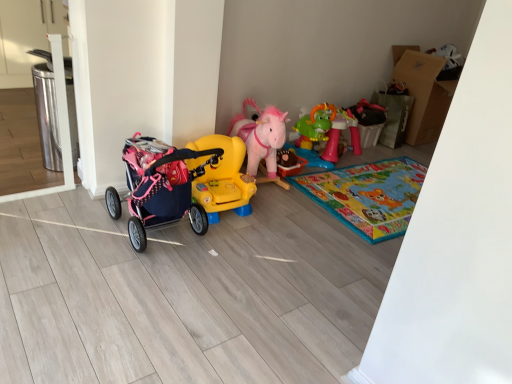
What do you see at coordinates (261, 139) in the screenshot? I see `pink plush horse at center, marked as the 2th toy in a right-to-left arrangement` at bounding box center [261, 139].

Image resolution: width=512 pixels, height=384 pixels. What do you see at coordinates (223, 178) in the screenshot? I see `yellow plastic ride-on car at center, the 2th toy positioned from the left` at bounding box center [223, 178].

What do you see at coordinates (162, 186) in the screenshot? This screenshot has width=512, height=384. I see `pink fabric stroller at left, which is counted as the 4th toy, starting from the right` at bounding box center [162, 186].

Where is `pink fabric stroller at left, the 1th toy when ordered from left to right`? The height and width of the screenshot is (384, 512). pink fabric stroller at left, the 1th toy when ordered from left to right is located at coordinates (162, 186).

I want to click on rubberized green dinosaur table at center-right, which ranks as the 4th toy in left-to-right order, so click(x=324, y=134).

This screenshot has width=512, height=384. What are the coordinates of `pink plush horse at center, marked as the 2th toy in a right-to-left arrangement` in the screenshot? It's located at (261, 139).

Is pink plush horse at center, placed as the third toy when sorted from left to right, inside the boundaries of yellow plastic ride-on car at center, which is the third toy in right-to-left order, or outside?

pink plush horse at center, placed as the third toy when sorted from left to right, exists outside the volume of yellow plastic ride-on car at center, which is the third toy in right-to-left order.

Can you confirm if pink plush horse at center, placed as the third toy when sorted from left to right, is thinner than yellow plastic ride-on car at center, the 2th toy positioned from the left?

Incorrect, the width of pink plush horse at center, placed as the third toy when sorted from left to right, is not less than that of yellow plastic ride-on car at center, the 2th toy positioned from the left.

How different are the orientations of pink plush horse at center, marked as the 2th toy in a right-to-left arrangement, and yellow plastic ride-on car at center, the 2th toy positioned from the left, in degrees?

11.8 degrees separate the facing orientations of pink plush horse at center, marked as the 2th toy in a right-to-left arrangement, and yellow plastic ride-on car at center, the 2th toy positioned from the left.

You are a GUI agent. You are given a task and a screenshot of the screen. Output one action in this format:
    pyautogui.click(x=<x>, y=<y>)
    Task: Click on the toy that is the 2nd object above the yellow plastic ride-on car at center, which is the third toy in right-to-left order (from a real-world perspective)
    The width and height of the screenshot is (512, 384).
    Given the screenshot: What is the action you would take?
    pyautogui.click(x=261, y=139)

Which of these two, pink fabric stroller at left, which is counted as the 4th toy, starting from the right, or yellow plastic ride-on car at center, the 2th toy positioned from the left, is thinner?

yellow plastic ride-on car at center, the 2th toy positioned from the left.

Is pink fabric stroller at left, which is counted as the 4th toy, starting from the right, smaller than yellow plastic ride-on car at center, the 2th toy positioned from the left?

No, pink fabric stroller at left, which is counted as the 4th toy, starting from the right, is not smaller than yellow plastic ride-on car at center, the 2th toy positioned from the left.

From a real-world perspective, which object stands above the other?

pink fabric stroller at left, which is counted as the 4th toy, starting from the right.

Is pink fabric stroller at left, which is counted as the 4th toy, starting from the right, at the back of yellow plastic ride-on car at center, the 2th toy positioned from the left?

No, yellow plastic ride-on car at center, the 2th toy positioned from the left, is not facing the opposite direction of pink fabric stroller at left, which is counted as the 4th toy, starting from the right.

Considering the relative sizes of yellow plastic ride-on car at center, which is the third toy in right-to-left order, and pink fabric stroller at left, which is counted as the 4th toy, starting from the right, in the image provided, is yellow plastic ride-on car at center, which is the third toy in right-to-left order, bigger than pink fabric stroller at left, which is counted as the 4th toy, starting from the right,?

No.

From a real-world perspective, between yellow plastic ride-on car at center, the 2th toy positioned from the left, and pink fabric stroller at left, which is counted as the 4th toy, starting from the right, who is vertically lower?

yellow plastic ride-on car at center, the 2th toy positioned from the left.

Based on their positions, is yellow plastic ride-on car at center, the 2th toy positioned from the left, located to the left or right of pink fabric stroller at left, which is counted as the 4th toy, starting from the right?

Clearly, yellow plastic ride-on car at center, the 2th toy positioned from the left, is on the right of pink fabric stroller at left, which is counted as the 4th toy, starting from the right, in the image.

Which of these two, pink plush horse at center, placed as the third toy when sorted from left to right, or rubberized green dinosaur table at center-right, acting as the first toy starting from the right, is wider?

pink plush horse at center, placed as the third toy when sorted from left to right.

From a real-world perspective, which object stands above the other?

pink plush horse at center, marked as the 2th toy in a right-to-left arrangement.

Would you say pink plush horse at center, marked as the 2th toy in a right-to-left arrangement, is inside or outside rubberized green dinosaur table at center-right, acting as the first toy starting from the right?

pink plush horse at center, marked as the 2th toy in a right-to-left arrangement, is not enclosed by rubberized green dinosaur table at center-right, acting as the first toy starting from the right.

In the scene shown: Based on their sizes in the image, would you say pink plush horse at center, placed as the third toy when sorted from left to right, is bigger or smaller than rubberized green dinosaur table at center-right, acting as the first toy starting from the right?

Clearly, pink plush horse at center, placed as the third toy when sorted from left to right, is larger in size than rubberized green dinosaur table at center-right, acting as the first toy starting from the right.

Is pink fabric stroller at left, the 1th toy when ordered from left to right, turned away from rubberized green dinosaur table at center-right, which ranks as the 4th toy in left-to-right order?

That's not correct — pink fabric stroller at left, the 1th toy when ordered from left to right, is not looking away from rubberized green dinosaur table at center-right, which ranks as the 4th toy in left-to-right order.

Which is correct: pink fabric stroller at left, which is counted as the 4th toy, starting from the right, is inside rubberized green dinosaur table at center-right, acting as the first toy starting from the right, or outside of it?

pink fabric stroller at left, which is counted as the 4th toy, starting from the right, is not enclosed by rubberized green dinosaur table at center-right, acting as the first toy starting from the right.

From the image's perspective, which is below, pink fabric stroller at left, the 1th toy when ordered from left to right, or rubberized green dinosaur table at center-right, which ranks as the 4th toy in left-to-right order?

pink fabric stroller at left, the 1th toy when ordered from left to right, is shown below in the image.

Considering the positions of objects pink fabric stroller at left, which is counted as the 4th toy, starting from the right, and rubberized green dinosaur table at center-right, acting as the first toy starting from the right, in the image provided, who is more to the left, pink fabric stroller at left, which is counted as the 4th toy, starting from the right, or rubberized green dinosaur table at center-right, acting as the first toy starting from the right,?

Positioned to the left is pink fabric stroller at left, which is counted as the 4th toy, starting from the right.

Can we say pink fabric stroller at left, the 1th toy when ordered from left to right, lies outside pink plush horse at center, placed as the third toy when sorted from left to right?

Yes.

Is point (159, 164) closer or farther from the camera than point (254, 125)?

Clearly, point (159, 164) is closer to the camera than point (254, 125).

Based on their positions, is pink fabric stroller at left, the 1th toy when ordered from left to right, located to the left or right of pink plush horse at center, placed as the third toy when sorted from left to right?

From the image, it's evident that pink fabric stroller at left, the 1th toy when ordered from left to right, is to the left of pink plush horse at center, placed as the third toy when sorted from left to right.

Based on the photo, between pink fabric stroller at left, which is counted as the 4th toy, starting from the right, and pink plush horse at center, marked as the 2th toy in a right-to-left arrangement, which one has larger width?

With larger width is pink plush horse at center, marked as the 2th toy in a right-to-left arrangement.

Is rubberized green dinosaur table at center-right, acting as the first toy starting from the right, not within pink plush horse at center, placed as the third toy when sorted from left to right?

rubberized green dinosaur table at center-right, acting as the first toy starting from the right, lies outside pink plush horse at center, placed as the third toy when sorted from left to right,'s area.

In the scene shown: From the image's perspective, is rubberized green dinosaur table at center-right, acting as the first toy starting from the right, on pink plush horse at center, placed as the third toy when sorted from left to right?

Yes, from the image's perspective, rubberized green dinosaur table at center-right, acting as the first toy starting from the right, is above pink plush horse at center, placed as the third toy when sorted from left to right.

From a real-world perspective, who is located higher, rubberized green dinosaur table at center-right, which ranks as the 4th toy in left-to-right order, or pink plush horse at center, placed as the third toy when sorted from left to right?

pink plush horse at center, placed as the third toy when sorted from left to right, is physically above.

Does rubberized green dinosaur table at center-right, which ranks as the 4th toy in left-to-right order, lie behind pink plush horse at center, marked as the 2th toy in a right-to-left arrangement?

Yes, rubberized green dinosaur table at center-right, which ranks as the 4th toy in left-to-right order, is further from the viewer.

The width and height of the screenshot is (512, 384). There is a yellow plastic ride-on car at center, which is the third toy in right-to-left order. Find the location of `the 1st toy above it (from the image's perspective)`. the 1st toy above it (from the image's perspective) is located at coordinates coord(261,139).

Where is `toy lying on the left of yellow plastic ride-on car at center, the 2th toy positioned from the left`? toy lying on the left of yellow plastic ride-on car at center, the 2th toy positioned from the left is located at coordinates (162, 186).

Considering their positions, is pink fabric stroller at left, the 1th toy when ordered from left to right, positioned further to rubberized green dinosaur table at center-right, which ranks as the 4th toy in left-to-right order, than pink plush horse at center, marked as the 2th toy in a right-to-left arrangement?

pink fabric stroller at left, the 1th toy when ordered from left to right, lies further to rubberized green dinosaur table at center-right, which ranks as the 4th toy in left-to-right order, than the other object.

From the picture: From the image, which object appears to be farther from yellow plastic ride-on car at center, the 2th toy positioned from the left, rubberized green dinosaur table at center-right, which ranks as the 4th toy in left-to-right order, or pink plush horse at center, placed as the third toy when sorted from left to right?

The object further to yellow plastic ride-on car at center, the 2th toy positioned from the left, is rubberized green dinosaur table at center-right, which ranks as the 4th toy in left-to-right order.

Which object lies further to the anchor point pink fabric stroller at left, which is counted as the 4th toy, starting from the right, rubberized green dinosaur table at center-right, acting as the first toy starting from the right, or yellow plastic ride-on car at center, the 2th toy positioned from the left?

Among the two, rubberized green dinosaur table at center-right, acting as the first toy starting from the right, is located further to pink fabric stroller at left, which is counted as the 4th toy, starting from the right.

Which object lies further to the anchor point rubberized green dinosaur table at center-right, acting as the first toy starting from the right, pink fabric stroller at left, which is counted as the 4th toy, starting from the right, or yellow plastic ride-on car at center, the 2th toy positioned from the left?

pink fabric stroller at left, which is counted as the 4th toy, starting from the right, lies further to rubberized green dinosaur table at center-right, acting as the first toy starting from the right, than the other object.

Which object lies further to the anchor point yellow plastic ride-on car at center, the 2th toy positioned from the left, pink fabric stroller at left, which is counted as the 4th toy, starting from the right, or pink plush horse at center, marked as the 2th toy in a right-to-left arrangement?

pink plush horse at center, marked as the 2th toy in a right-to-left arrangement, lies further to yellow plastic ride-on car at center, the 2th toy positioned from the left, than the other object.

Looking at the image, which one is located closer to yellow plastic ride-on car at center, the 2th toy positioned from the left, pink plush horse at center, placed as the third toy when sorted from left to right, or pink fabric stroller at left, which is counted as the 4th toy, starting from the right?

pink fabric stroller at left, which is counted as the 4th toy, starting from the right, is positioned closer to the anchor yellow plastic ride-on car at center, the 2th toy positioned from the left.

From the image, which object appears to be farther from yellow plastic ride-on car at center, which is the third toy in right-to-left order, pink fabric stroller at left, which is counted as the 4th toy, starting from the right, or rubberized green dinosaur table at center-right, which ranks as the 4th toy in left-to-right order?

Among the two, rubberized green dinosaur table at center-right, which ranks as the 4th toy in left-to-right order, is located further to yellow plastic ride-on car at center, which is the third toy in right-to-left order.

When comparing their distances from rubberized green dinosaur table at center-right, acting as the first toy starting from the right, does yellow plastic ride-on car at center, which is the third toy in right-to-left order, or pink plush horse at center, marked as the 2th toy in a right-to-left arrangement, seem further?

Among the two, yellow plastic ride-on car at center, which is the third toy in right-to-left order, is located further to rubberized green dinosaur table at center-right, acting as the first toy starting from the right.

Locate an element on the screen. The width and height of the screenshot is (512, 384). toy between yellow plastic ride-on car at center, the 2th toy positioned from the left, and rubberized green dinosaur table at center-right, acting as the first toy starting from the right, from left to right is located at coordinates (261, 139).

You are a GUI agent. You are given a task and a screenshot of the screen. Output one action in this format:
    pyautogui.click(x=<x>, y=<y>)
    Task: Click on the toy between pink fabric stroller at left, the 1th toy when ordered from left to right, and pink plush horse at center, placed as the third toy when sorted from left to right, along the z-axis
    
    Given the screenshot: What is the action you would take?
    pyautogui.click(x=223, y=178)